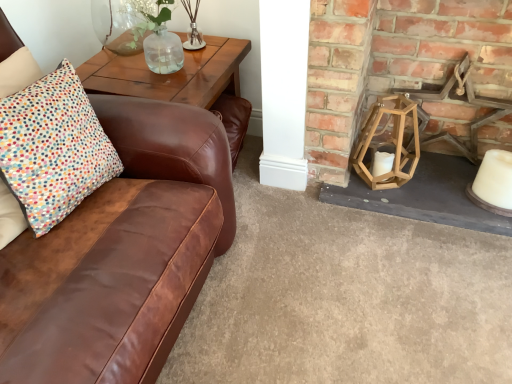
Where is `wooden hexagonal lantern at right, which ranks as the second candle holder in top-to-bottom order`? The height and width of the screenshot is (384, 512). wooden hexagonal lantern at right, which ranks as the second candle holder in top-to-bottom order is located at coordinates (388, 141).

This screenshot has height=384, width=512. What do you see at coordinates (388, 141) in the screenshot?
I see `wooden hexagonal lantern at right, which is the 2th candle holder in left-to-right order` at bounding box center [388, 141].

This screenshot has width=512, height=384. What are the coordinates of `wooden lantern at right` in the screenshot? It's located at (392, 63).

Measure the distance between point (201, 53) and camera.

Point (201, 53) is 1.83 meters from camera.

Where is `wooden hexagonal lantern at right, which ranks as the second candle holder in top-to-bottom order`? wooden hexagonal lantern at right, which ranks as the second candle holder in top-to-bottom order is located at coordinates (388, 141).

Is there a large distance between wooden lantern at right and clear glass vase at upper center, arranged as the second candle holder when ordered from the bottom?

No, there isn't a large distance between wooden lantern at right and clear glass vase at upper center, arranged as the second candle holder when ordered from the bottom.

Considering the sizes of objects wooden lantern at right and clear glass vase at upper center, arranged as the second candle holder when ordered from the bottom, in the image provided, who is wider, wooden lantern at right or clear glass vase at upper center, arranged as the second candle holder when ordered from the bottom,?

Wider between the two is wooden lantern at right.

Considering the points (318, 60) and (200, 34), which point is behind, point (318, 60) or point (200, 34)?

The point (200, 34) is farther.

Between wooden lantern at right and clear glass vase at upper center, acting as the 2th candle holder starting from the right, which one has less height?

With less height is clear glass vase at upper center, acting as the 2th candle holder starting from the right.

From the picture: Can you confirm if multicolored dotted cushion at left is smaller than wooden table at upper left?

Indeed, multicolored dotted cushion at left has a smaller size compared to wooden table at upper left.

Based on the photo, is multicolored dotted cushion at left far from wooden table at upper left?

No.

Between multicolored dotted cushion at left and wooden table at upper left, which one appears on the left side from the viewer's perspective?

Positioned to the left is multicolored dotted cushion at left.

Is multicolored dotted cushion at left positioned with its back to wooden table at upper left?

multicolored dotted cushion at left does not have its back to wooden table at upper left.

Is clear glass vase at upper center, acting as the 2th candle holder starting from the right, not near wooden hexagonal lantern at right, the first candle holder from the right?

No.

Is clear glass vase at upper center, the first candle holder viewed from the left, at the right side of wooden hexagonal lantern at right, which ranks as the second candle holder in top-to-bottom order?

Incorrect, clear glass vase at upper center, the first candle holder viewed from the left, is not on the right side of wooden hexagonal lantern at right, which ranks as the second candle holder in top-to-bottom order.

Is clear glass vase at upper center, acting as the 2th candle holder starting from the right, in front of or behind wooden hexagonal lantern at right, which ranks as the second candle holder in top-to-bottom order, in the image?

In the image, clear glass vase at upper center, acting as the 2th candle holder starting from the right, appears behind wooden hexagonal lantern at right, which ranks as the second candle holder in top-to-bottom order.

Can you confirm if clear glass vase at upper center, arranged as the second candle holder when ordered from the bottom, is wider than wooden hexagonal lantern at right, the first candle holder from the right?

No.

Could you tell me if white matte candle at lower right is turned towards wooden hexagonal lantern at right, which ranks as the second candle holder in top-to-bottom order?

No, white matte candle at lower right is not aimed at wooden hexagonal lantern at right, which ranks as the second candle holder in top-to-bottom order.

Is white matte candle at lower right behind wooden hexagonal lantern at right, which is counted as the 1th candle holder, starting from the bottom?

Yes, the depth of white matte candle at lower right is greater than that of wooden hexagonal lantern at right, which is counted as the 1th candle holder, starting from the bottom.

At what (x,y) coordinates should I click in order to perform the action: click on candle on the right of wooden hexagonal lantern at right, the first candle holder from the right. Please return your answer as a coordinate pair (x, y). Looking at the image, I should click on (495, 179).

Would you say white matte candle at lower right is outside multicolored dotted cushion at left?

Yes, white matte candle at lower right is outside of multicolored dotted cushion at left.

Considering the sizes of white matte candle at lower right and multicolored dotted cushion at left in the image, is white matte candle at lower right bigger or smaller than multicolored dotted cushion at left?

white matte candle at lower right is smaller than multicolored dotted cushion at left.

Looking at their sizes, would you say white matte candle at lower right is wider or thinner than multicolored dotted cushion at left?

Considering their sizes, white matte candle at lower right looks slimmer than multicolored dotted cushion at left.

Can wooden table at upper left be found inside clear glass vase at upper center, marked as the 1th candle holder in a top-to-bottom arrangement?

Definitely not — wooden table at upper left is not inside clear glass vase at upper center, marked as the 1th candle holder in a top-to-bottom arrangement.

Is clear glass vase at upper center, acting as the 2th candle holder starting from the right, in front of or behind wooden table at upper left in the image?

clear glass vase at upper center, acting as the 2th candle holder starting from the right, is positioned farther from the viewer than wooden table at upper left.

Which object is positioned more to the right, clear glass vase at upper center, arranged as the second candle holder when ordered from the bottom, or wooden table at upper left?

clear glass vase at upper center, arranged as the second candle holder when ordered from the bottom, is more to the right.

From the image's perspective, is clear glass vase at upper center, the first candle holder viewed from the left, above or below wooden table at upper left?

Clearly, from the image's perspective, clear glass vase at upper center, the first candle holder viewed from the left, is above wooden table at upper left.

How distant is wooden hexagonal lantern at right, the first candle holder from the right, from white matte candle at lower right?

The distance of wooden hexagonal lantern at right, the first candle holder from the right, from white matte candle at lower right is 14.51 inches.

Identify the location of candle behind the wooden hexagonal lantern at right, which is counted as the 1th candle holder, starting from the bottom. Image resolution: width=512 pixels, height=384 pixels. (495, 179).

Which object is positioned more to the right, wooden hexagonal lantern at right, which ranks as the second candle holder in top-to-bottom order, or white matte candle at lower right?

From the viewer's perspective, white matte candle at lower right appears more on the right side.

Is the depth of wooden hexagonal lantern at right, which is the 2th candle holder in left-to-right order, greater than that of white matte candle at lower right?

No, wooden hexagonal lantern at right, which is the 2th candle holder in left-to-right order, is in front of white matte candle at lower right.

I want to click on the 2nd candle holder behind the wooden lantern at right, counting from the anchor's position, so click(x=193, y=27).

Locate an element on the screen. The image size is (512, 384). pillow on the left of wooden table at upper left is located at coordinates (53, 148).

Estimate the real-world distances between objects in this image. Which object is closer to wooden table at upper left, wooden lantern at right or wooden hexagonal lantern at right, which ranks as the second candle holder in top-to-bottom order?

wooden lantern at right lies closer to wooden table at upper left than the other object.

Considering their positions, is wooden hexagonal lantern at right, which ranks as the second candle holder in top-to-bottom order, positioned further to wooden table at upper left than white matte candle at lower right?

The object further to wooden table at upper left is white matte candle at lower right.

Considering their positions, is multicolored dotted cushion at left positioned further to wooden table at upper left than white matte candle at lower right?

white matte candle at lower right is further to wooden table at upper left.

Based on their spatial positions, is clear glass vase at upper center, the first candle holder viewed from the left, or wooden table at upper left further from wooden lantern at right?

clear glass vase at upper center, the first candle holder viewed from the left, is further to wooden lantern at right.

Estimate the real-world distances between objects in this image. Which object is further from clear glass vase at upper center, arranged as the second candle holder when ordered from the bottom, multicolored dotted cushion at left or wooden lantern at right?

Based on the image, wooden lantern at right appears to be further to clear glass vase at upper center, arranged as the second candle holder when ordered from the bottom.

Estimate the real-world distances between objects in this image. Which object is further from wooden hexagonal lantern at right, the first candle holder from the right, wooden lantern at right or white matte candle at lower right?

Based on the image, white matte candle at lower right appears to be further to wooden hexagonal lantern at right, the first candle holder from the right.

Estimate the real-world distances between objects in this image. Which object is closer to white matte candle at lower right, wooden table at upper left or wooden hexagonal lantern at right, which ranks as the second candle holder in top-to-bottom order?

The object closer to white matte candle at lower right is wooden hexagonal lantern at right, which ranks as the second candle holder in top-to-bottom order.

Estimate the real-world distances between objects in this image. Which object is closer to white matte candle at lower right, wooden hexagonal lantern at right, which is counted as the 1th candle holder, starting from the bottom, or clear glass vase at upper center, acting as the 2th candle holder starting from the right?

Among the two, wooden hexagonal lantern at right, which is counted as the 1th candle holder, starting from the bottom, is located nearer to white matte candle at lower right.

Image resolution: width=512 pixels, height=384 pixels. In order to click on candle holder located between clear glass vase at upper center, marked as the 1th candle holder in a top-to-bottom arrangement, and white matte candle at lower right in the left-right direction in this screenshot , I will do `click(388, 141)`.

Where is `table between multicolored dotted cushion at left and wooden hexagonal lantern at right, which ranks as the second candle holder in top-to-bottom order`? This screenshot has width=512, height=384. table between multicolored dotted cushion at left and wooden hexagonal lantern at right, which ranks as the second candle holder in top-to-bottom order is located at coordinates (181, 82).

Where is `fireplace situated between wooden table at upper left and white matte candle at lower right from left to right`? fireplace situated between wooden table at upper left and white matte candle at lower right from left to right is located at coordinates (392, 63).

Locate an element on the screen. This screenshot has width=512, height=384. table between multicolored dotted cushion at left and white matte candle at lower right from left to right is located at coordinates (181, 82).